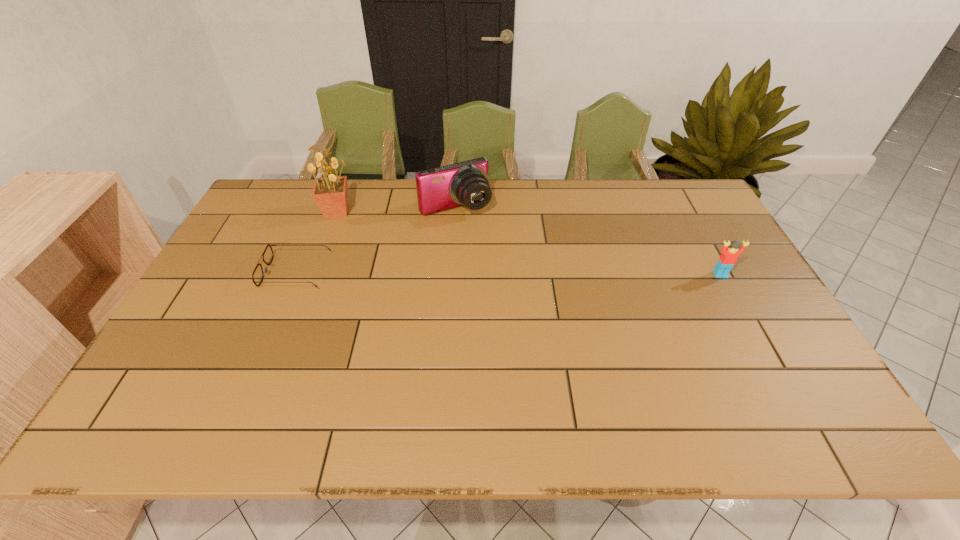
You are a GUI agent. You are given a task and a screenshot of the screen. Output one action in this format:
    pyautogui.click(x=<x>, y=<y>)
    Task: Click on the free location at the near edge
    The image size is (960, 540).
    Given the screenshot: What is the action you would take?
    pyautogui.click(x=627, y=361)

This screenshot has height=540, width=960. In the image, there is a desktop. In order to click on vacant region at the left edge in this screenshot , I will do `click(280, 230)`.

The width and height of the screenshot is (960, 540). What are the coordinates of `free region at the right edge` in the screenshot? It's located at (698, 226).

In the image, there is a desktop. At what (x,y) coordinates should I click in order to perform the action: click on vacant space at the far right corner. Please return your answer as a coordinate pair (x, y). Looking at the image, I should click on (700, 204).

Image resolution: width=960 pixels, height=540 pixels. I want to click on vacant area between the sunglasses and the second shortest object, so click(508, 273).

What are the coordinates of `free space between the sunglasses and the camera` in the screenshot? It's located at (375, 240).

Where is `vacant point located between the sunglasses and the second tallest object`? vacant point located between the sunglasses and the second tallest object is located at coordinates (375, 240).

Identify the location of vacant space in between the camera and the tallest object. (396, 210).

The height and width of the screenshot is (540, 960). In order to click on empty location between the rightmost object and the tallest object in this screenshot , I will do `click(529, 243)`.

I want to click on empty space between the rightmost object and the shortest object, so click(508, 273).